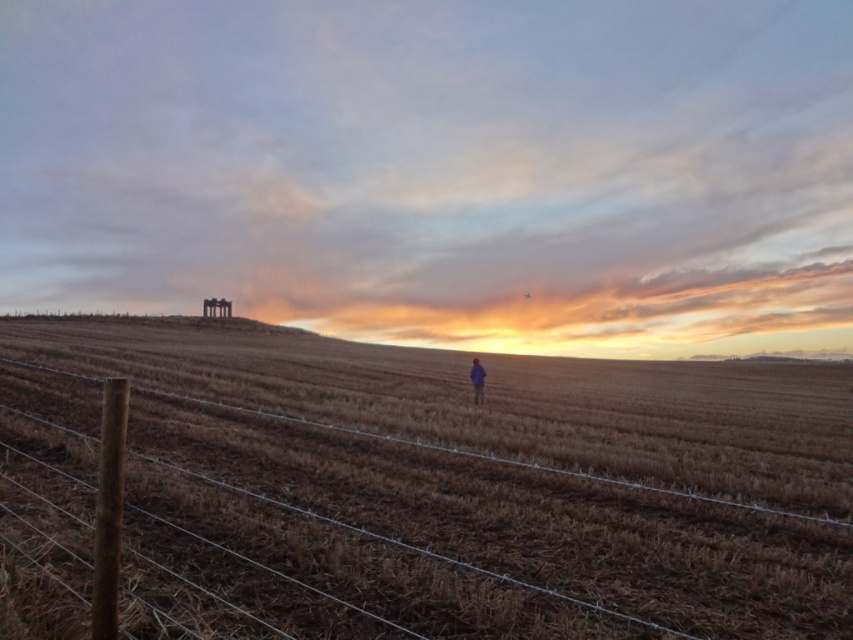
Does point (529, 461) lie behind point (485, 372)?

No.

Which is behind, point (271, 616) or point (474, 368)?

The point (474, 368) is behind.

This screenshot has width=853, height=640. Describe the element at coordinates (433, 488) in the screenshot. I see `brown grass at center` at that location.

Find the location of `brown grass at center`. brown grass at center is located at coordinates (433, 488).